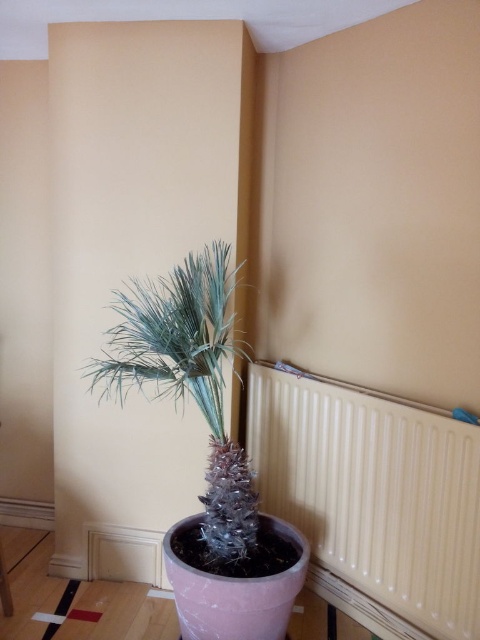
Is white textured radiator at lower right taller than silvery metallic plant at center?

No, white textured radiator at lower right is not taller than silvery metallic plant at center.

Who is positioned more to the left, white textured radiator at lower right or silvery metallic plant at center?

From the viewer's perspective, silvery metallic plant at center appears more on the left side.

Locate an element on the screen. The width and height of the screenshot is (480, 640). white textured radiator at lower right is located at coordinates (372, 499).